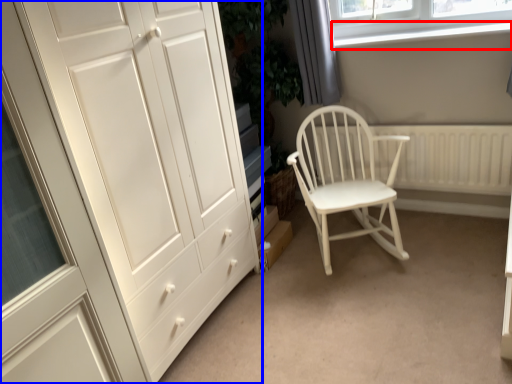
Question: Among these objects, which one is farthest to the camera, window sill (highlighted by a red box) or cupboard (highlighted by a blue box)?

Choices:
 (A) window sill
 (B) cupboard

Answer: (A)